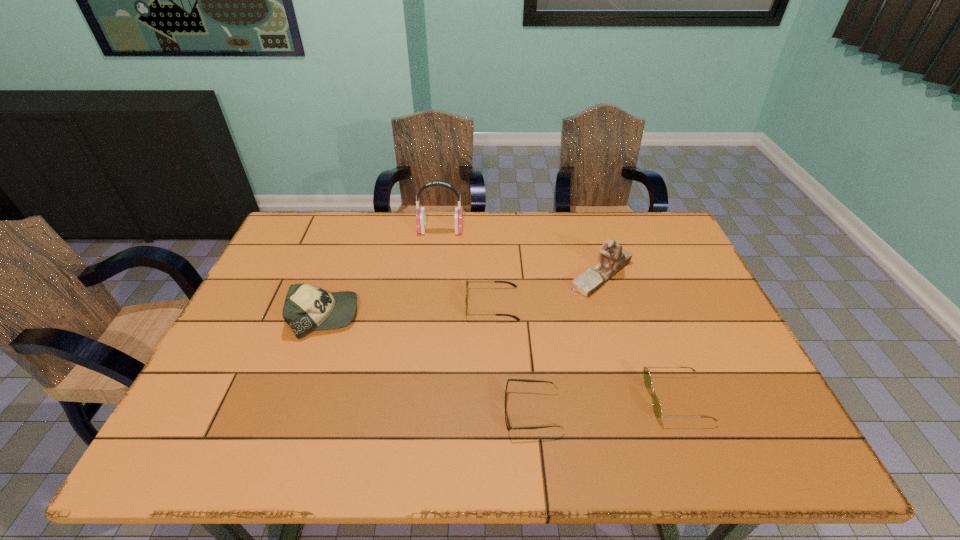
Identify the location of vacant position at the right edge of the desktop. (653, 291).

This screenshot has width=960, height=540. Identify the location of vacant space at the far right corner of the desktop. [x=644, y=217].

Image resolution: width=960 pixels, height=540 pixels. In the image, there is a desktop. What are the coordinates of `vacant area at the near right corner` in the screenshot? It's located at (748, 445).

Where is `vacant space that is in between the rightmost sunglasses and the figurine`? vacant space that is in between the rightmost sunglasses and the figurine is located at coordinates (639, 336).

This screenshot has width=960, height=540. I want to click on vacant area that lies between the farthest sunglasses and the rightmost sunglasses, so click(585, 351).

You are a GUI agent. You are given a task and a screenshot of the screen. Output one action in this format:
    pyautogui.click(x=<x>, y=<y>)
    Task: Click on the free spot between the farthest object and the farthest sunglasses
    The image size is (960, 540).
    Given the screenshot: What is the action you would take?
    pyautogui.click(x=467, y=267)

The height and width of the screenshot is (540, 960). I want to click on free spot between the farthest object and the farthest sunglasses, so click(467, 267).

The width and height of the screenshot is (960, 540). Identify the location of vacant space that's between the earphone and the shortest object. (487, 321).

Locate an element on the screen. empty space that is in between the leftmost object and the shortest sunglasses is located at coordinates (429, 364).

This screenshot has height=540, width=960. What are the coordinates of `empty space between the shortest object and the leftmost object` in the screenshot? It's located at (429, 364).